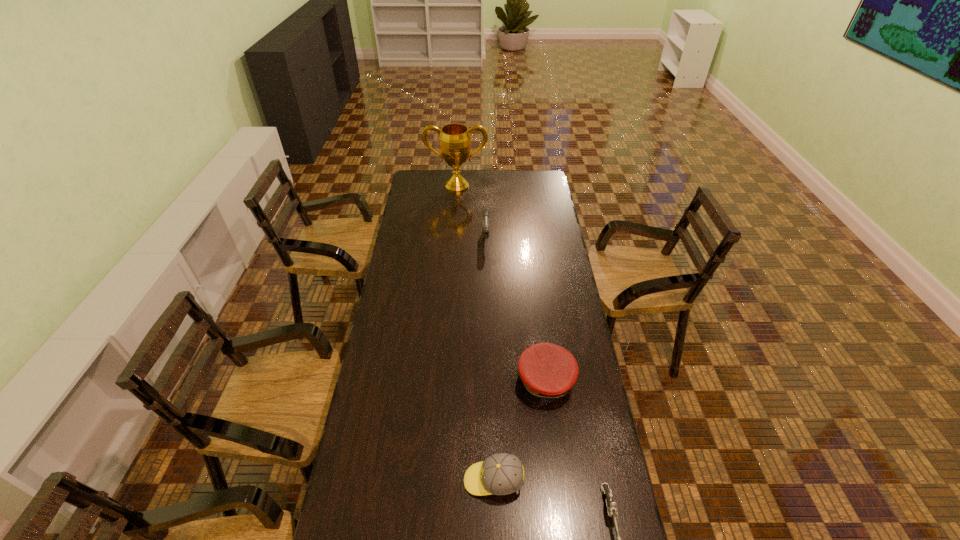
I want to click on the tallest object, so click(x=455, y=143).

You are a GUI agent. You are given a task and a screenshot of the screen. Output one action in this format:
    pyautogui.click(x=<x>, y=<y>)
    Task: Click on the farthest object
    
    Given the screenshot: What is the action you would take?
    pyautogui.click(x=455, y=143)

You are a GUI agent. You are given a task and a screenshot of the screen. Output one action in this format:
    pyautogui.click(x=<x>, y=<y>)
    Task: Click on the farther gun
    
    Given the screenshot: What is the action you would take?
    pyautogui.click(x=485, y=212)

Identify the location of the left gun. The width and height of the screenshot is (960, 540). (485, 212).

The width and height of the screenshot is (960, 540). I want to click on cap, so click(547, 371).

Where is `baseball cap`? The height and width of the screenshot is (540, 960). baseball cap is located at coordinates (499, 474).

You are a GUI agent. You are given a task and a screenshot of the screen. Output one action in this format:
    pyautogui.click(x=<x>, y=<y>)
    Task: Click on the vacant space located on the front-facing side of the award
    This screenshot has width=960, height=540.
    Given the screenshot: What is the action you would take?
    pyautogui.click(x=454, y=230)

Image resolution: width=960 pixels, height=540 pixels. I want to click on vacant space located 0.080m in the direction the farther gun is aimed, so click(x=486, y=261).

Image resolution: width=960 pixels, height=540 pixels. Identify the location of vacant area situated 0.400m at the front of the cap where the visor is located. (564, 537).

Find the location of a particular element. This screenshot has width=960, height=540. free space located 0.360m on the front-facing side of the baseball cap is located at coordinates (345, 481).